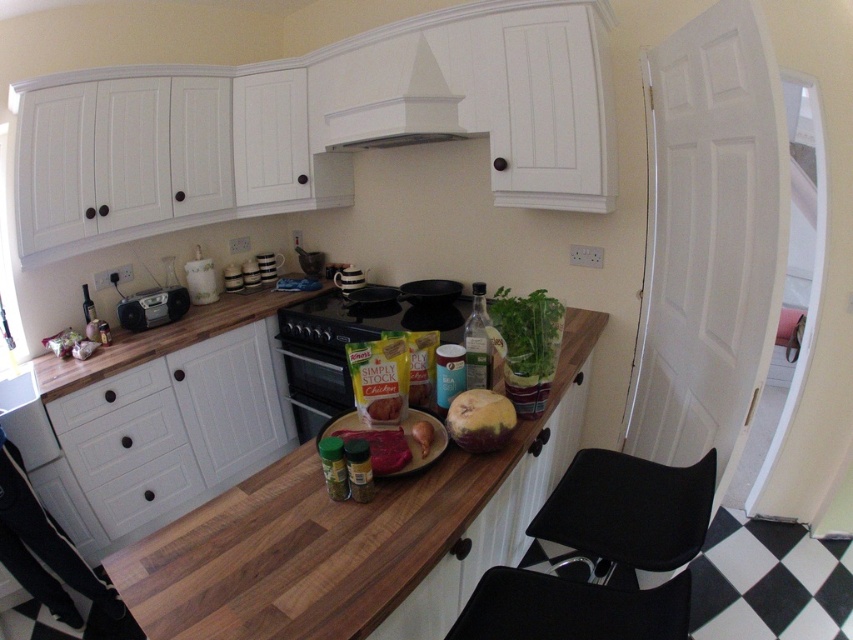
Question: Is wooden at center closer to the viewer compared to black matte stove at center?

Choices:
 (A) no
 (B) yes

Answer: (B)

Question: Where is white wood drawer at lower left located in relation to smooth brown bread at center in the image?

Choices:
 (A) right
 (B) left

Answer: (B)

Question: Among these points, which one is nearest to the camera?

Choices:
 (A) (399, 397)
 (B) (152, 321)
 (C) (347, 116)
 (D) (68, 428)

Answer: (A)

Question: Does wooden at center come behind white matte drawer at lower left?

Choices:
 (A) no
 (B) yes

Answer: (A)

Question: Which object is the farthest from the white matte drawer at lower left?

Choices:
 (A) green leafy vegetable at center
 (B) matte black radio at left
 (C) smooth brown bread at center

Answer: (A)

Question: Which point appears closest to the camera in this image?

Choices:
 (A) (341, 349)
 (B) (276, 337)
 (C) (515, 348)
 (D) (352, 52)

Answer: (C)